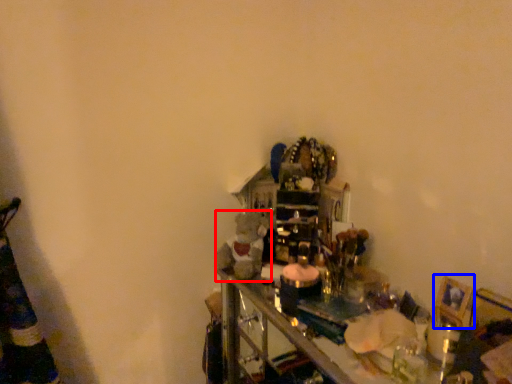
Question: Which object is closer to the camera taking this photo, toy (highlighted by a red box) or picture frame (highlighted by a blue box)?

Choices:
 (A) toy
 (B) picture frame

Answer: (B)